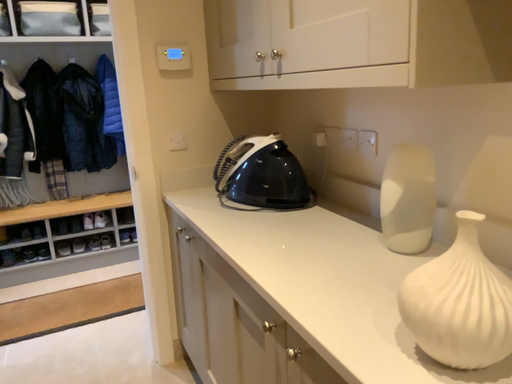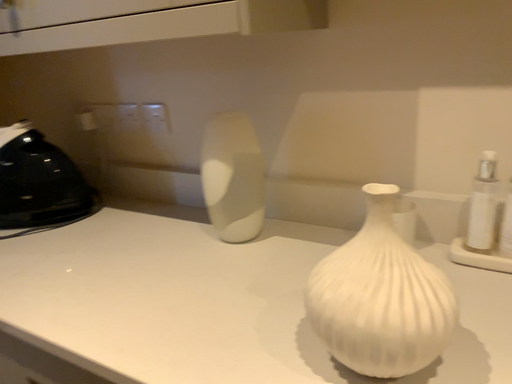
Question: How did the camera likely rotate when shooting the video?

Choices:
 (A) rotated left
 (B) rotated right

Answer: (B)